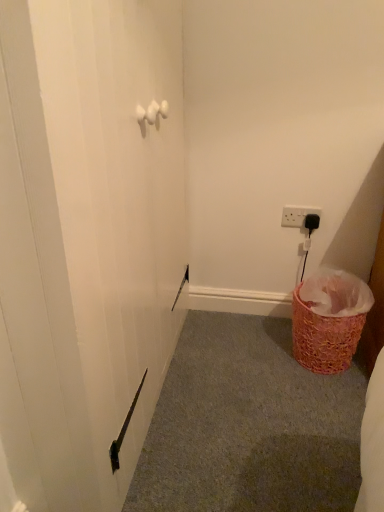
Image resolution: width=384 pixels, height=512 pixels. Find the location of `free location above pink woven basket at lower right (from a real-world perspective)`. free location above pink woven basket at lower right (from a real-world perspective) is located at coordinates (247, 401).